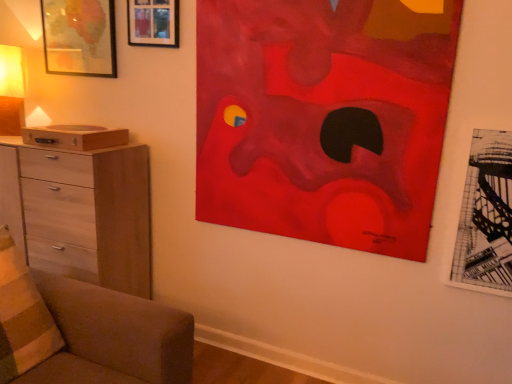
Question: Is matte red abstract painting at upper right surrounding wooden picture frame at upper left, the first picture frame when ordered from top to bottom?

Choices:
 (A) no
 (B) yes

Answer: (A)

Question: Considering the relative sizes of matte red abstract painting at upper right and wooden picture frame at upper left, the first picture frame when ordered from top to bottom, in the image provided, is matte red abstract painting at upper right bigger than wooden picture frame at upper left, the first picture frame when ordered from top to bottom,?

Choices:
 (A) no
 (B) yes

Answer: (B)

Question: Is matte red abstract painting at upper right further to the viewer compared to wooden picture frame at upper left, marked as the 2th picture frame in a left-to-right arrangement?

Choices:
 (A) yes
 (B) no

Answer: (B)

Question: Considering the relative sizes of matte red abstract painting at upper right and wooden picture frame at upper left, which is the 2th picture frame in back-to-front order, in the image provided, is matte red abstract painting at upper right thinner than wooden picture frame at upper left, which is the 2th picture frame in back-to-front order,?

Choices:
 (A) no
 (B) yes

Answer: (B)

Question: Is matte red abstract painting at upper right completely or partially outside of wooden picture frame at upper left, the 3th picture frame positioned from the bottom?

Choices:
 (A) yes
 (B) no

Answer: (A)

Question: Is light wood chest of drawers at left bigger or smaller than brown fabric couch at lower left?

Choices:
 (A) small
 (B) big

Answer: (B)

Question: Is light wood chest of drawers at left in front of or behind brown fabric couch at lower left in the image?

Choices:
 (A) behind
 (B) front

Answer: (A)

Question: Is point (47, 153) positioned closer to the camera than point (129, 377)?

Choices:
 (A) closer
 (B) farther

Answer: (B)

Question: Considering the positions of light wood chest of drawers at left and brown fabric couch at lower left in the image, is light wood chest of drawers at left taller or shorter than brown fabric couch at lower left?

Choices:
 (A) tall
 (B) short

Answer: (A)

Question: Is matte yellow fabric at left bigger or smaller than light wood chest of drawers at left?

Choices:
 (A) small
 (B) big

Answer: (A)

Question: Is point (20, 54) positioned closer to the camera than point (136, 198)?

Choices:
 (A) farther
 (B) closer

Answer: (A)

Question: Is matte yellow fabric at left inside or outside of light wood chest of drawers at left?

Choices:
 (A) outside
 (B) inside

Answer: (A)

Question: In terms of width, does matte yellow fabric at left look wider or thinner when compared to light wood chest of drawers at left?

Choices:
 (A) thin
 (B) wide

Answer: (A)

Question: Does point (1, 276) appear closer or farther from the camera than point (4, 52)?

Choices:
 (A) farther
 (B) closer

Answer: (B)

Question: In the image, is striped fabric pillow at lower left on the left side or the right side of matte yellow fabric at left?

Choices:
 (A) left
 (B) right

Answer: (B)